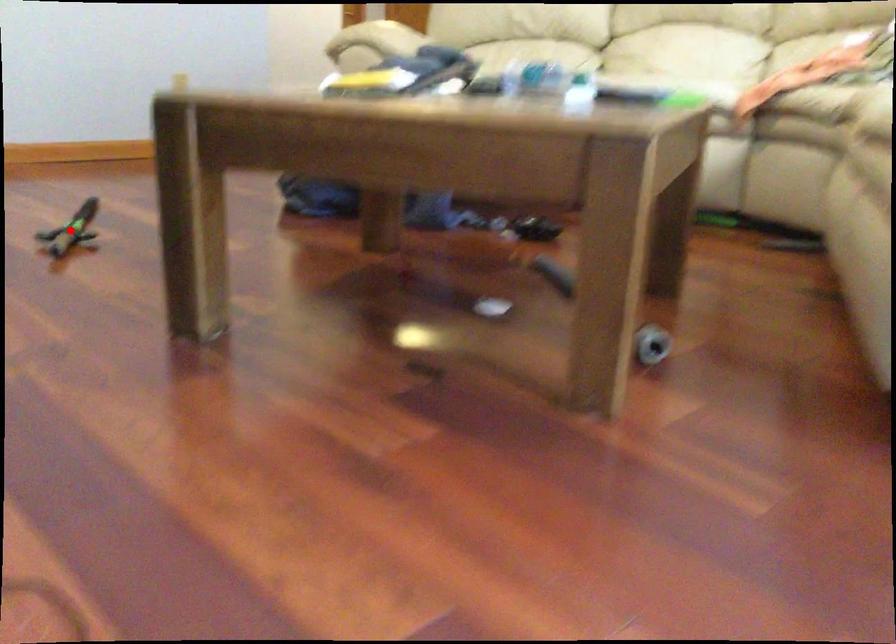
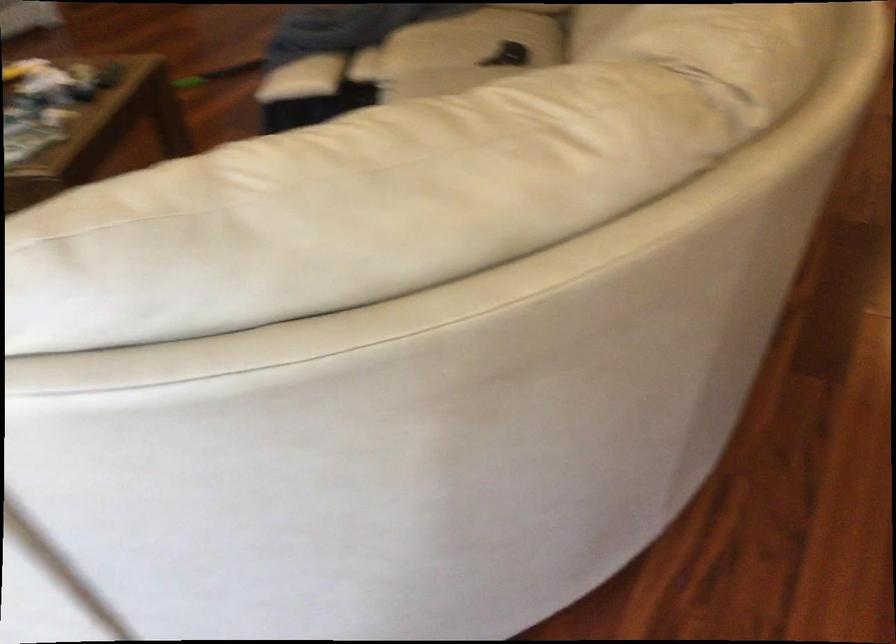
Question: I am providing you with two images of the same scene from different viewpoints. A red point is marked on the first image. Is the red point's position out of view in image 2?

Choices:
 (A) Yes
 (B) No

Answer: (A)